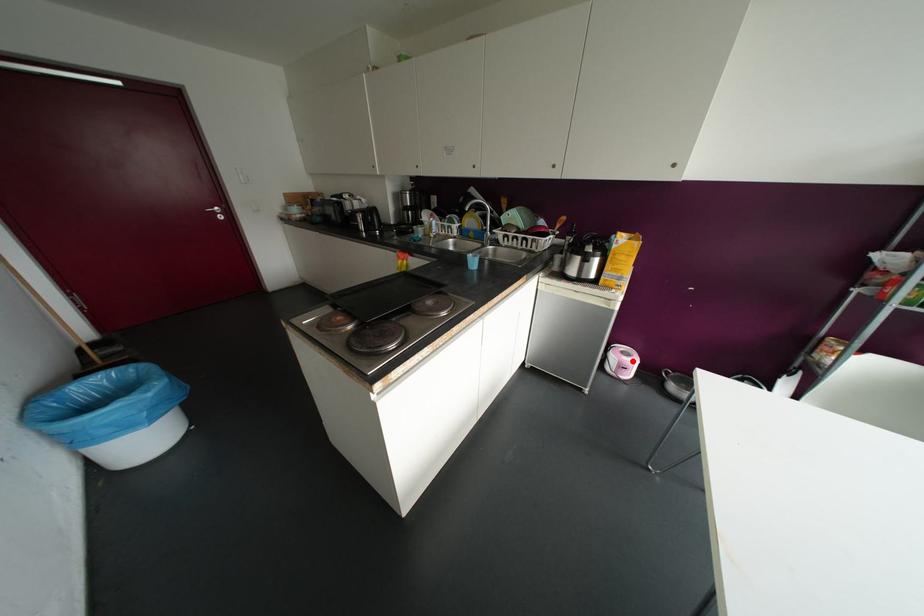
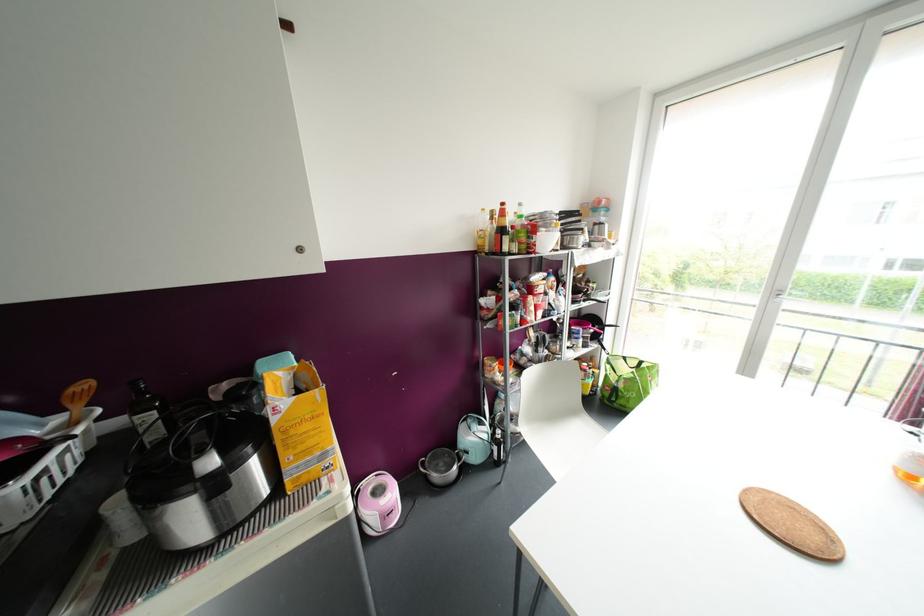
Where in the second image is the point corresponding to the highlighted location from the first image?

(392, 493)